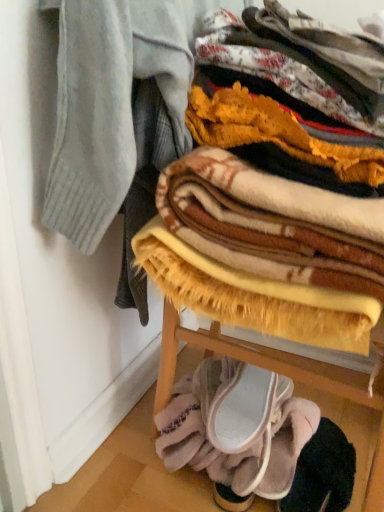
Question: From a real-world perspective, is plush yellow blanket at center, acting as the first blanket starting from the top, positioned above or below pink suede slipper at lower center, which appears as the 1th footwear when viewed from the top?

Choices:
 (A) above
 (B) below

Answer: (A)

Question: Considering the positions of plush yellow blanket at center, acting as the first blanket starting from the top, and pink suede slipper at lower center, which appears as the 1th footwear when viewed from the top, in the image, is plush yellow blanket at center, acting as the first blanket starting from the top, taller or shorter than pink suede slipper at lower center, which appears as the 1th footwear when viewed from the top,?

Choices:
 (A) tall
 (B) short

Answer: (A)

Question: Which is nearer to the soft yellow blanket at lower center, the second blanket when ordered from top to bottom?

Choices:
 (A) light gray ribbed sweater at upper left
 (B) pink suede slipper at lower center, which appears as the 1th footwear when viewed from the top
 (C) pink suede sneakers at lower center, the second footwear from the top
 (D) plush yellow blanket at center, acting as the first blanket starting from the top

Answer: (B)

Question: Based on their relative distances, which object is farther from the soft yellow blanket at lower center, acting as the 1th blanket starting from the bottom?

Choices:
 (A) light gray ribbed sweater at upper left
 (B) pink suede sneakers at lower center, placed as the 1th footwear when sorted from bottom to top
 (C) plush yellow blanket at center, the 2th blanket ordered from the bottom
 (D) pink suede slipper at lower center, placed as the 2th footwear when sorted from bottom to top

Answer: (A)